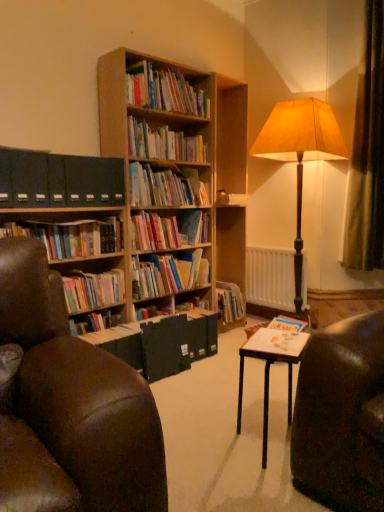
Locate an element on the screen. The width and height of the screenshot is (384, 512). free space in front of wooden table at center is located at coordinates (252, 492).